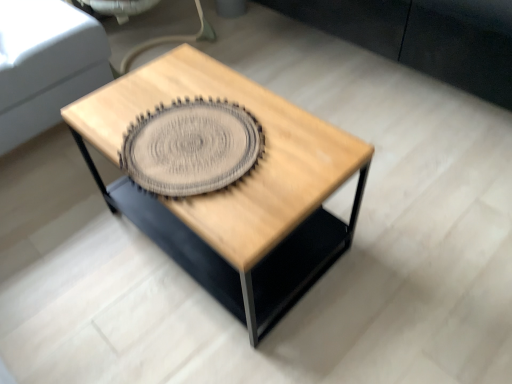
Locate an element on the screen. The height and width of the screenshot is (384, 512). space that is in front of natural wood coffee table at center is located at coordinates (223, 344).